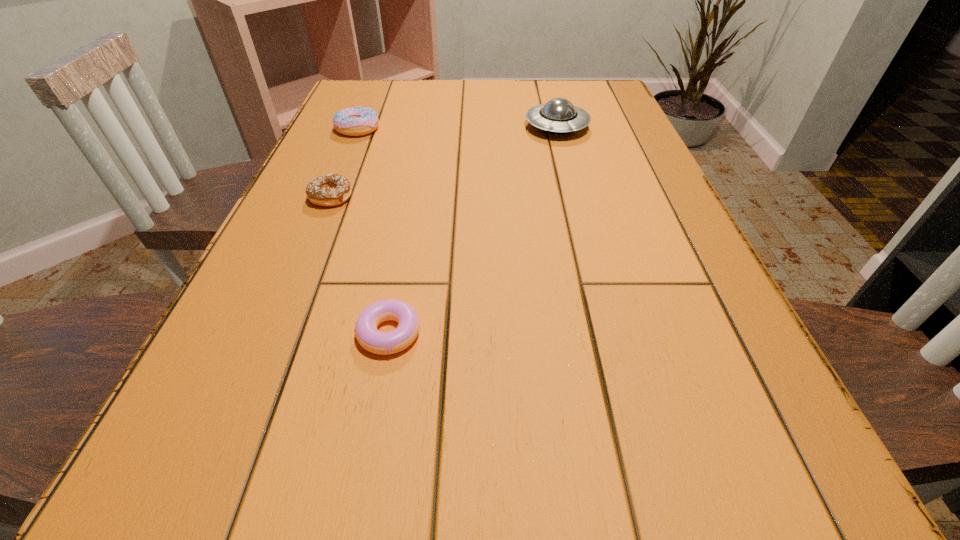
Choose which object is the second nearest neighbor to the tallest doughnut. Please provide its 2D coordinates. Your answer should be formatted as a tuple, i.e. [(x, y)], where the tuple contains the x and y coordinates of a point satisfying the conditions above.

[(558, 116)]

Where is `doughnut that is the second closest to the second nearest object`? The width and height of the screenshot is (960, 540). doughnut that is the second closest to the second nearest object is located at coordinates (383, 343).

Choose which doughnut is the second nearest neighbor to the nearest doughnut. Please provide its 2D coordinates. Your answer should be formatted as a tuple, i.e. [(x, y)], where the tuple contains the x and y coordinates of a point satisfying the conditions above.

[(357, 121)]

Locate an element on the screen. vacant point that satisfies the following two spatial constraints: 1. on the back side of the shortest object; 2. on the left side of the tallest object is located at coordinates (427, 127).